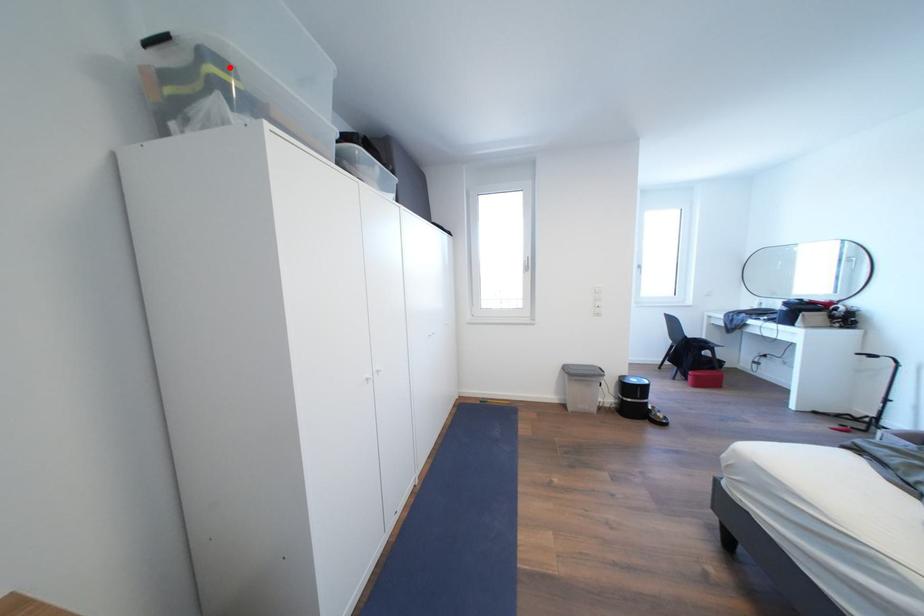
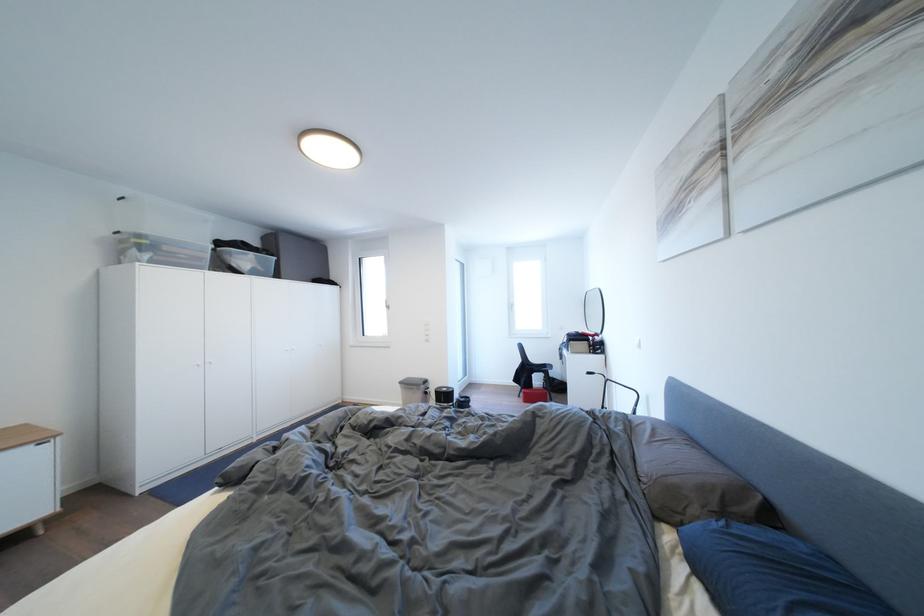
Question: I am providing you with two images of the same scene from different viewpoints. A red point is marked on the first image. Can you still see the location of the red point in image 2?

Choices:
 (A) Yes
 (B) No

Answer: (A)